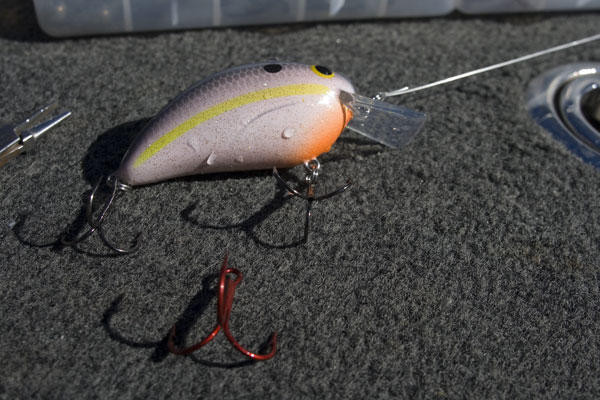
Locate an element on the screen. The width and height of the screenshot is (600, 400). hook is located at coordinates (224, 307), (310, 185), (94, 225).